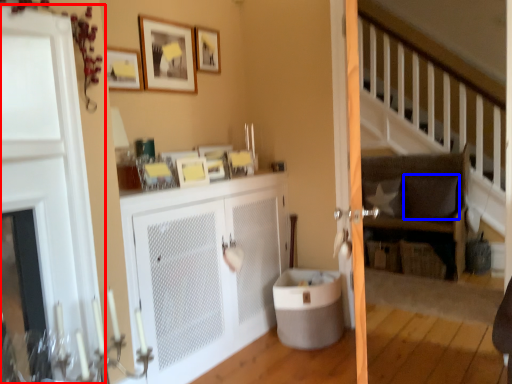
Question: Which object is closer to the camera taking this photo, door (highlighted by a red box) or pillow (highlighted by a blue box)?

Choices:
 (A) door
 (B) pillow

Answer: (A)